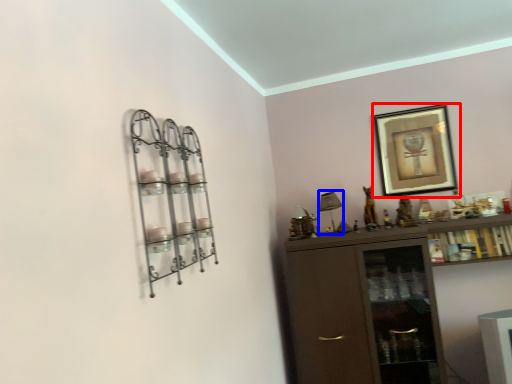
Question: Which object appears farthest to the camera in this image, picture frame (highlighted by a red box) or lamp (highlighted by a blue box)?

Choices:
 (A) picture frame
 (B) lamp

Answer: (A)